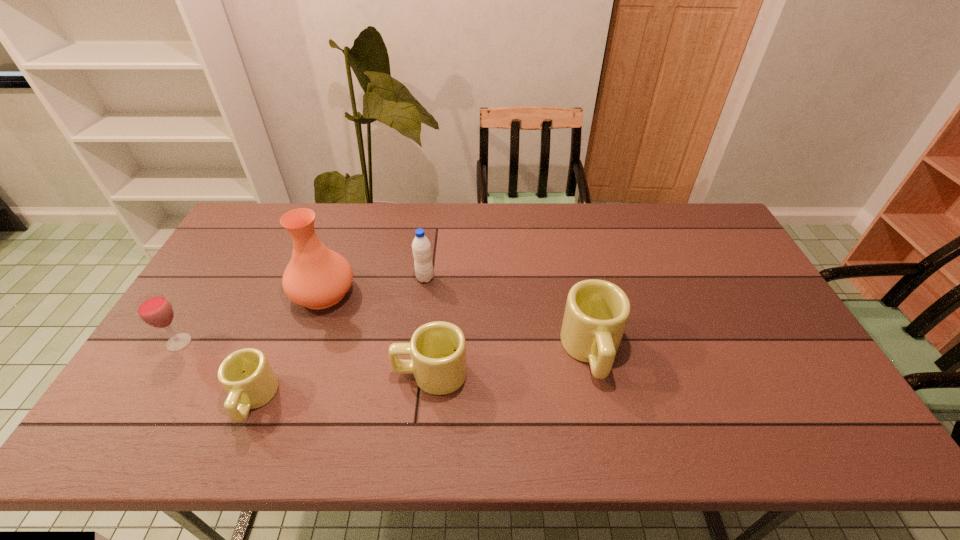
With all mugs evenly spaced, where should an extra mug be placed on the right to continue the pattern? Please point out a vacant space. Please provide its 2D coordinates. Your answer should be formatted as a tuple, i.e. [(x, y)], where the tuple contains the x and y coordinates of a point satisfying the conditions above.

[(738, 329)]